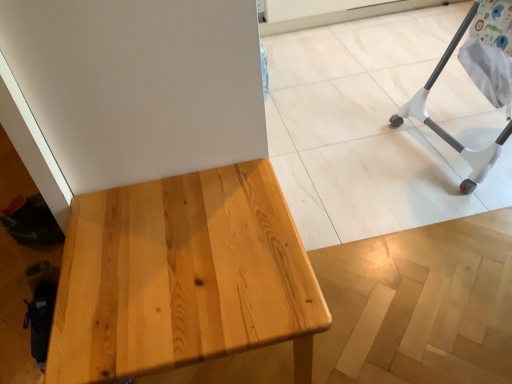
This screenshot has width=512, height=384. What do you see at coordinates (434, 82) in the screenshot?
I see `white plastic baby bouncer at right` at bounding box center [434, 82].

Identify the location of white plastic baby bouncer at right. coord(434,82).

Locate an element on the screen. The image size is (512, 384). natural wood table at center is located at coordinates (182, 277).

The image size is (512, 384). What do you see at coordinates (182, 277) in the screenshot?
I see `natural wood table at center` at bounding box center [182, 277].

Locate an element on the screen. This screenshot has height=384, width=512. white plastic baby bouncer at right is located at coordinates (434, 82).

Which is more to the right, white plastic baby bouncer at right or natural wood table at center?

white plastic baby bouncer at right.

Is white plastic baby bouncer at right in front of natural wood table at center?

No.

Is point (460, 187) farther from camera compared to point (281, 312)?

Yes, it is.

From the image's perspective, relative to natural wood table at center, is white plastic baby bouncer at right above or below?

white plastic baby bouncer at right is above natural wood table at center.

From a real-world perspective, which object rests below the other?

From a 3D spatial view, natural wood table at center is below.

Which of these two, white plastic baby bouncer at right or natural wood table at center, is thinner?

Thinner between the two is natural wood table at center.

Who is taller, white plastic baby bouncer at right or natural wood table at center?

Standing taller between the two is white plastic baby bouncer at right.

Is white plastic baby bouncer at right bigger than natural wood table at center?

Correct, white plastic baby bouncer at right is larger in size than natural wood table at center.

Is white plastic baby bouncer at right spatially inside natural wood table at center, or outside of it?

white plastic baby bouncer at right cannot be found inside natural wood table at center.

Would you consider white plastic baby bouncer at right to be distant from natural wood table at center?

Yes, white plastic baby bouncer at right and natural wood table at center are quite far apart.

Does white plastic baby bouncer at right turn towards natural wood table at center?

Yes, white plastic baby bouncer at right is aimed at natural wood table at center.

What's the angular difference between white plastic baby bouncer at right and natural wood table at center's facing directions?

The angular difference between white plastic baby bouncer at right and natural wood table at center is 89.8 degrees.

This screenshot has width=512, height=384. I want to click on furniture on the right side of natural wood table at center, so tap(434, 82).

Would you say natural wood table at center is to the left or to the right of white plastic baby bouncer at right in the picture?

Based on their positions, natural wood table at center is located to the left of white plastic baby bouncer at right.

Considering the relative positions of natural wood table at center and white plastic baby bouncer at right in the image provided, is natural wood table at center behind white plastic baby bouncer at right?

No.

Which point is more forward, [120,324] or [415,116]?

Point [120,324]

From the image's perspective, is natural wood table at center located beneath white plastic baby bouncer at right?

Yes, from the image's perspective, natural wood table at center is below white plastic baby bouncer at right.

From a real-world perspective, is natural wood table at center above or below white plastic baby bouncer at right?

natural wood table at center is situated lower than white plastic baby bouncer at right in the real world.

In terms of width, does natural wood table at center look wider or thinner when compared to white plastic baby bouncer at right?

natural wood table at center is thinner than white plastic baby bouncer at right.

Who is shorter, natural wood table at center or white plastic baby bouncer at right?

natural wood table at center.

Does natural wood table at center have a larger size compared to white plastic baby bouncer at right?

No.

Is natural wood table at center inside the boundaries of white plastic baby bouncer at right, or outside?

natural wood table at center cannot be found inside white plastic baby bouncer at right.

Is natural wood table at center far from white plastic baby bouncer at right?

natural wood table at center is positioned a significant distance from white plastic baby bouncer at right.

Does natural wood table at center turn towards white plastic baby bouncer at right?

No, natural wood table at center is not turned towards white plastic baby bouncer at right.

Can you tell me how much natural wood table at center and white plastic baby bouncer at right differ in facing direction?

The angle between the facing direction of natural wood table at center and the facing direction of white plastic baby bouncer at right is 89.8 degrees.

Locate an element on the screen. This screenshot has width=512, height=384. furniture behind the natural wood table at center is located at coordinates (434, 82).

At what (x,y) coordinates should I click in order to perform the action: click on table below the white plastic baby bouncer at right (from the image's perspective). Please return your answer as a coordinate pair (x, y). This screenshot has height=384, width=512. Looking at the image, I should click on (182, 277).

Locate an element on the screen. This screenshot has height=384, width=512. table that appears in front of the white plastic baby bouncer at right is located at coordinates (182, 277).